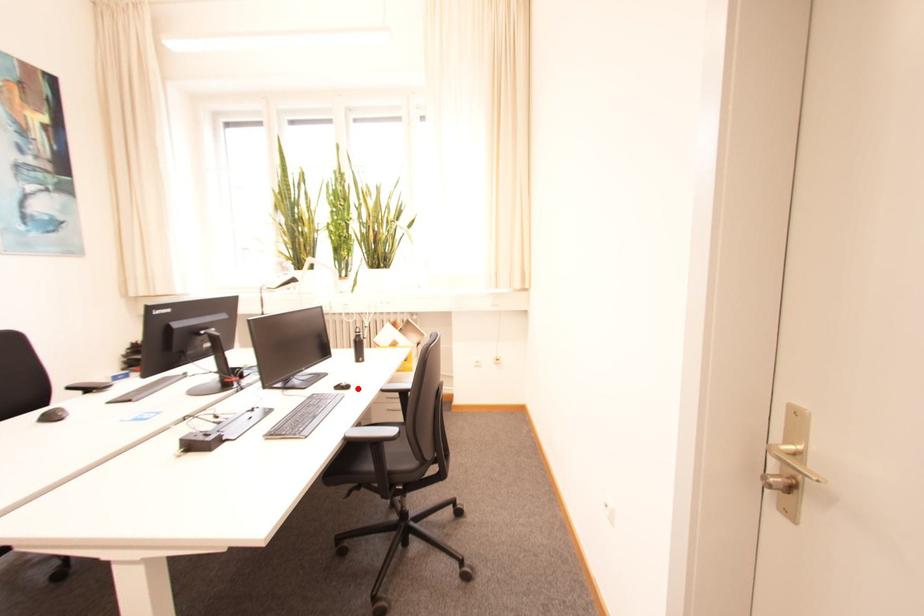
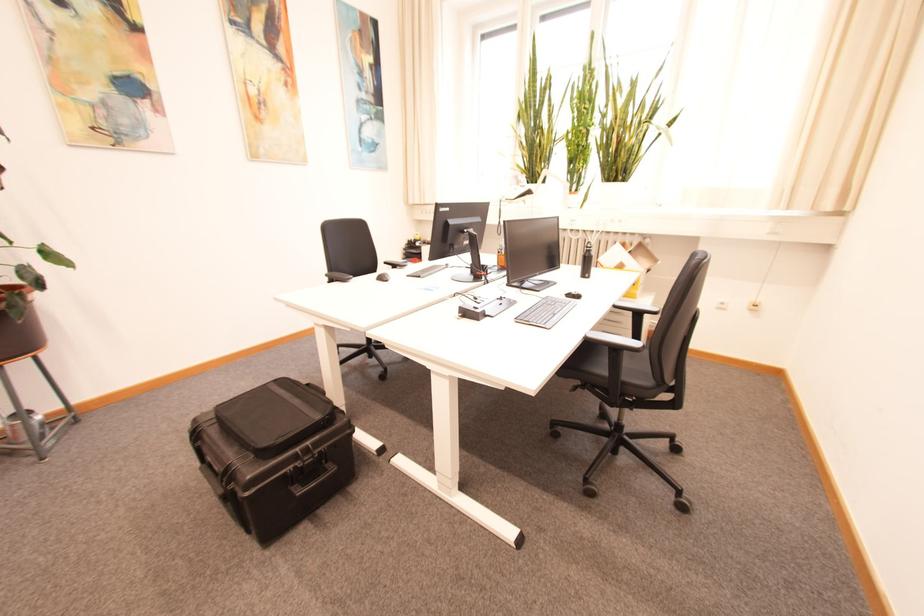
Where in the second image is the point corresponding to the highlighted location from the first image?

(589, 299)